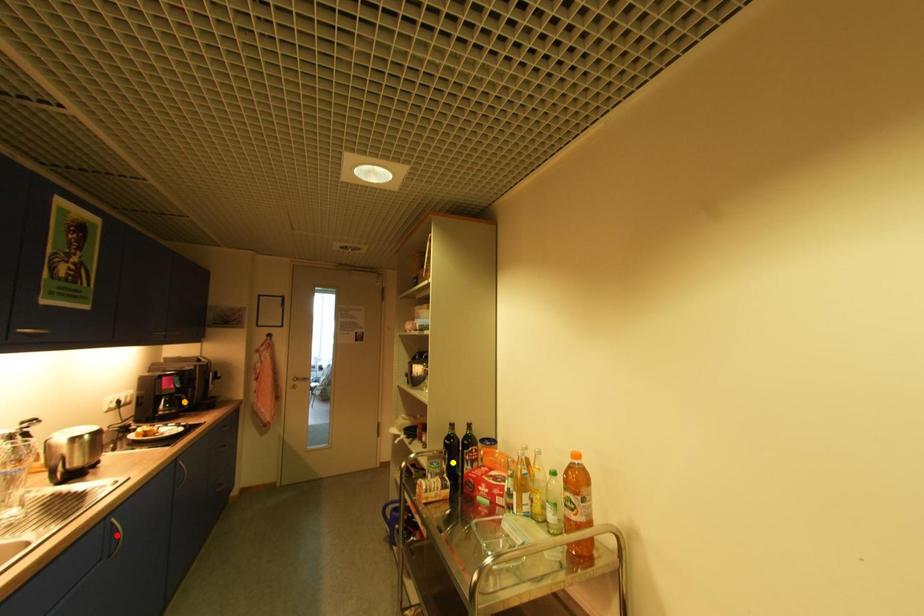
Order these from nearest to farthest:
- orange point
- red point
- yellow point

red point, yellow point, orange point